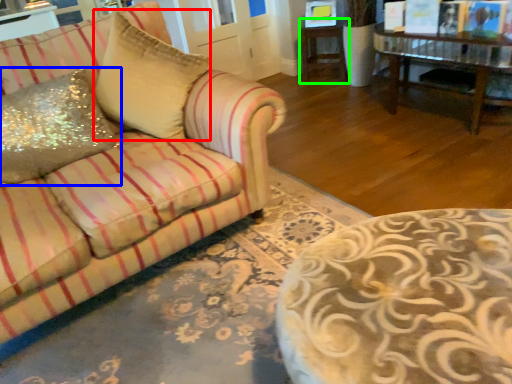
Question: Which is nearer to the throw pillow (highlighted by a red box)? throw pillow (highlighted by a blue box) or side table (highlighted by a green box).

Choices:
 (A) throw pillow
 (B) side table

Answer: (A)